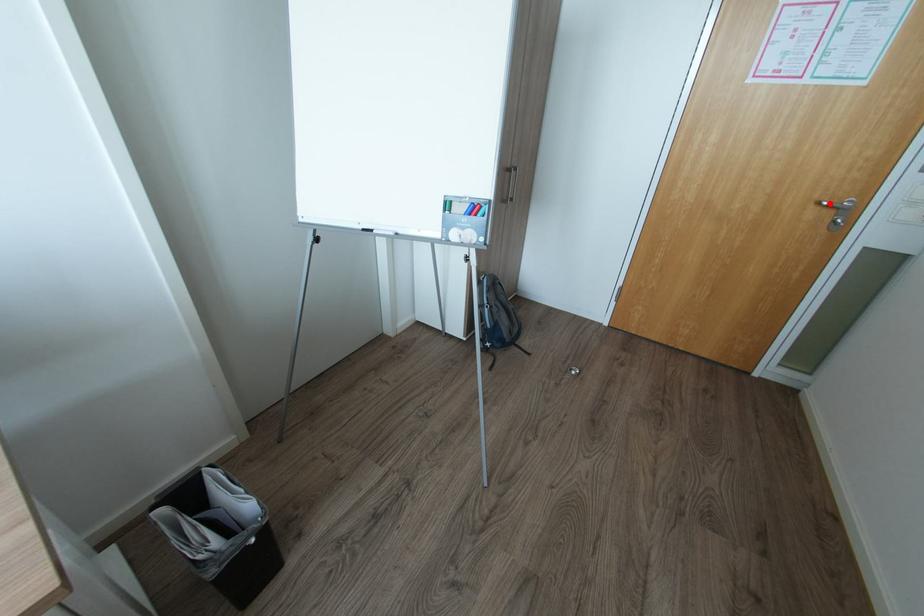
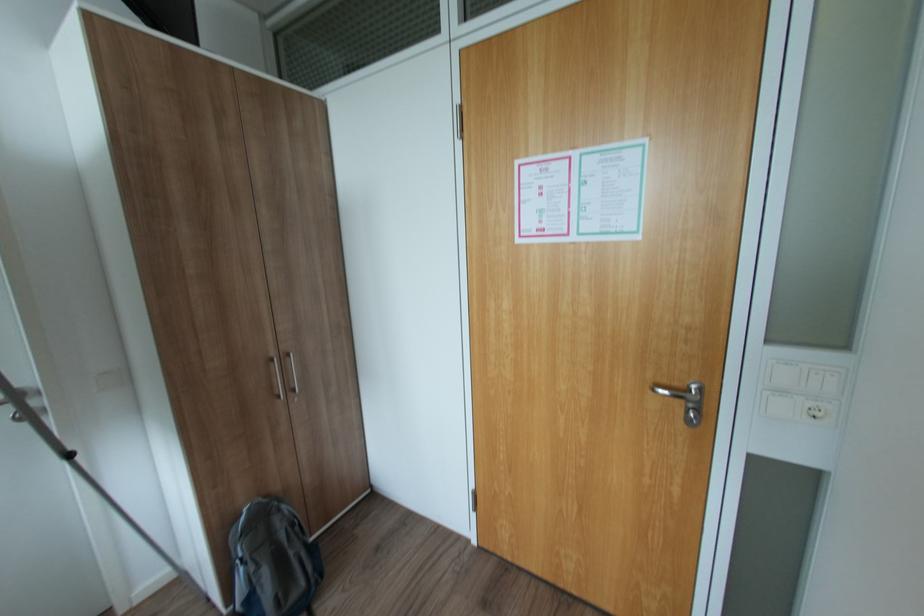
The point at the highlighted location is marked in the first image. Where is the corresponding point in the second image?

(664, 390)